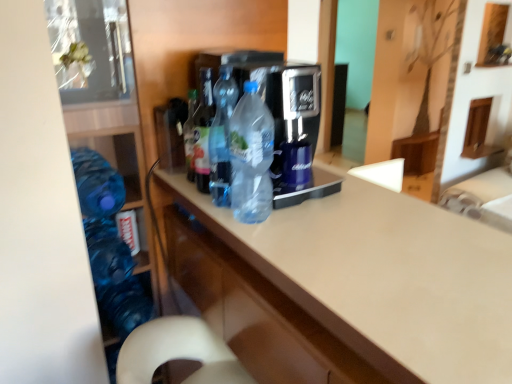
The height and width of the screenshot is (384, 512). I want to click on vacant space in front of transparent plastic bottles at center, so click(338, 254).